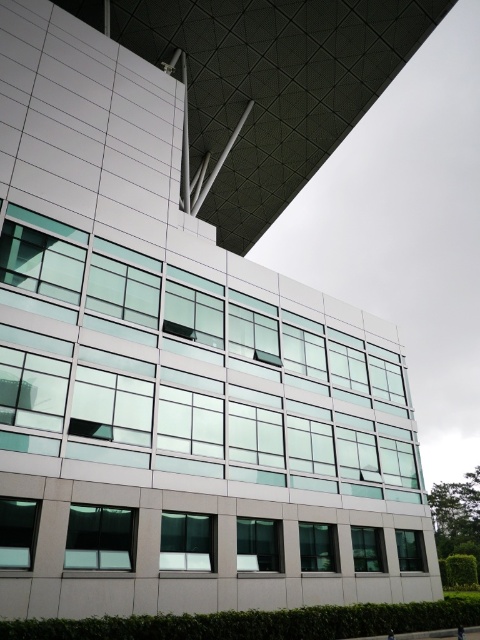
You are standing in front of the modern building and notice two clear glass windows. The first is labeled as the clear glass window at lower left and the second as the clear glass window at lower center. From your vantage point, which window is positioned higher up?

The clear glass window at lower left is above the clear glass window at lower center, so it is positioned higher up.

You are an architect evaluating the building facade. You need to determine which window has a greater width between the transparent glass window at upper left and the clear glass window at lower right. Based on the scene, can you identify which one is wider?

The transparent glass window at upper left is wider than the clear glass window at lower right according to the description provided.

You are standing in front of the modern building and want to locate the clear glass window at lower left. According to the coordinates provided, where would you look to find it?

The clear glass window at lower left is located at point (16, 531).